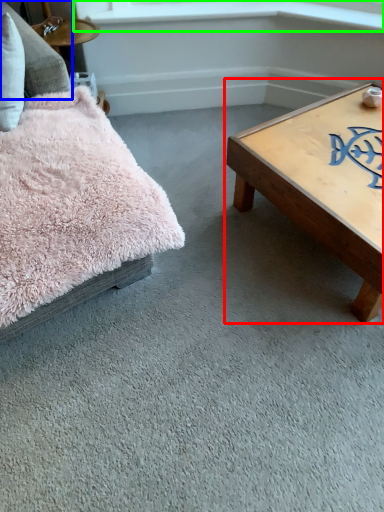
Question: Considering the real-world distances, which object is closest to coffee table (highlighted by a red box)? pillow (highlighted by a blue box) or window sill (highlighted by a green box).

Choices:
 (A) pillow
 (B) window sill

Answer: (B)